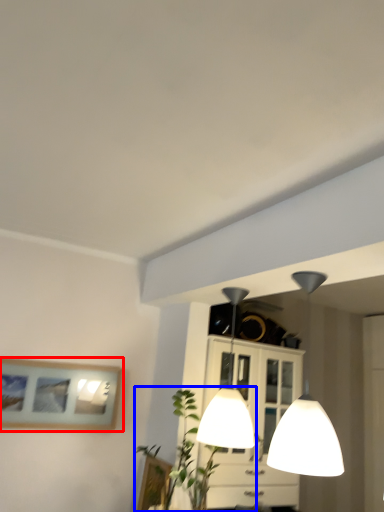
Question: Which object is further to the camera taking this photo, picture frame (highlighted by a red box) or plant (highlighted by a blue box)?

Choices:
 (A) picture frame
 (B) plant

Answer: (A)